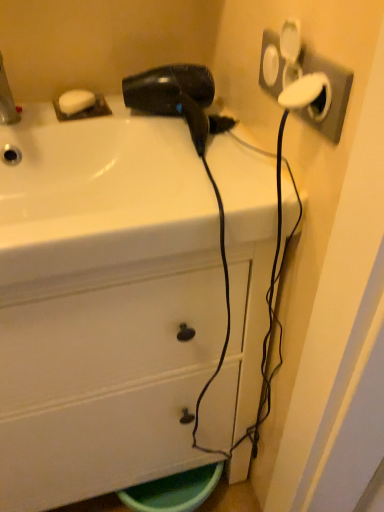
Describe the element at coordinates (304, 75) in the screenshot. I see `white plastic socket at upper right` at that location.

Image resolution: width=384 pixels, height=512 pixels. In order to click on black matte hair dryer at upper center in this screenshot , I will do `click(178, 98)`.

The width and height of the screenshot is (384, 512). Find the location of `brushed metal faucet at upper left`. brushed metal faucet at upper left is located at coordinates (7, 100).

This screenshot has height=512, width=384. What do you see at coordinates (102, 304) in the screenshot?
I see `white glossy cabinet at center` at bounding box center [102, 304].

In order to click on white glossy sink at upper center in this screenshot , I will do `click(99, 193)`.

This screenshot has height=512, width=384. In order to click on white plastic socket at upper right in this screenshot , I will do `click(304, 75)`.

Which is in front, white matte soap at upper left or white glossy sink at upper center?

white glossy sink at upper center is more forward.

In the image, there is a white matte soap at upper left. Find the location of `sink below it (from a real-world perspective)`. sink below it (from a real-world perspective) is located at coordinates (99, 193).

Does white matte soap at upper left contain white glossy sink at upper center?

No.

Is white matte soap at upper left further to camera compared to white glossy cabinet at center?

That is True.

Is white matte soap at upper left oriented towards white glossy cabinet at center?

No, white matte soap at upper left is not turned towards white glossy cabinet at center.

Considering the positions of points (78, 89) and (44, 323), is point (78, 89) closer to camera compared to point (44, 323)?

No, (78, 89) is further to viewer.

Between white glossy sink at upper center and black matte hair dryer at upper center, which one has smaller width?

black matte hair dryer at upper center is thinner.

Is white glossy sink at upper center bigger than black matte hair dryer at upper center?

Indeed, white glossy sink at upper center has a larger size compared to black matte hair dryer at upper center.

From the image's perspective, which one is positioned higher, white glossy sink at upper center or black matte hair dryer at upper center?

From the image's view, black matte hair dryer at upper center is above.

Does white glossy cabinet at center have a lesser height compared to white plastic socket at upper right?

No.

Is white glossy cabinet at center behind white plastic socket at upper right?

Yes, the depth of white glossy cabinet at center is greater than that of white plastic socket at upper right.

From a real-world perspective, is white glossy cabinet at center physically below white plastic socket at upper right?

Correct, in the physical world, white glossy cabinet at center is lower than white plastic socket at upper right.

From the image's perspective, is white glossy cabinet at center located beneath white plastic socket at upper right?

Yes.

In the scene shown: Which of these two, black matte hair dryer at upper center or white plastic socket at upper right, stands taller?

white plastic socket at upper right.

From a real-world perspective, is black matte hair dryer at upper center on top of white plastic socket at upper right?

No.

Visually, is black matte hair dryer at upper center positioned to the left or to the right of white plastic socket at upper right?

black matte hair dryer at upper center is to the left of white plastic socket at upper right.

Is white glossy cabinet at center wider than black matte hair dryer at upper center?

Indeed, white glossy cabinet at center has a greater width compared to black matte hair dryer at upper center.

Are white glossy cabinet at center and black matte hair dryer at upper center far apart?

white glossy cabinet at center is actually quite close to black matte hair dryer at upper center.

Can you confirm if white glossy cabinet at center is smaller than black matte hair dryer at upper center?

Incorrect, white glossy cabinet at center is not smaller in size than black matte hair dryer at upper center.

Between point (188, 450) and point (194, 76), which one is positioned in front?

The point (194, 76) is closer to the camera.

Which point is more distant from viewer, (311, 55) or (115, 414)?

Point (115, 414)

Is white plastic socket at upper right positioned in front of white glossy cabinet at center?

Yes, white plastic socket at upper right is closer to the viewer.

Is white plastic socket at upper right beside white glossy cabinet at center?

No.

From a real-world perspective, which is physically below, white plastic socket at upper right or white glossy cabinet at center?

white glossy cabinet at center.

Find the location of a particular element. This screenshot has height=512, width=384. sink on the right of white matte soap at upper left is located at coordinates (99, 193).

Where is `bathroom cabinet located below the white matte soap at upper left (from the image's perspective)`? bathroom cabinet located below the white matte soap at upper left (from the image's perspective) is located at coordinates (102, 304).

Looking at the image, which one is located closer to white glossy sink at upper center, white matte soap at upper left or white plastic socket at upper right?

white matte soap at upper left lies closer to white glossy sink at upper center than the other object.

Looking at the image, which one is located further to brushed metal faucet at upper left, white glossy cabinet at center or white glossy sink at upper center?

Among the two, white glossy cabinet at center is located further to brushed metal faucet at upper left.

Based on the photo, estimate the real-world distances between objects in this image. Which object is closer to white glossy cabinet at center, brushed metal faucet at upper left or black matte hair dryer at upper center?

black matte hair dryer at upper center lies closer to white glossy cabinet at center than the other object.

Which object lies further to the anchor point white matte soap at upper left, white glossy sink at upper center or white plastic socket at upper right?

white plastic socket at upper right is positioned further to the anchor white matte soap at upper left.

Based on their spatial positions, is brushed metal faucet at upper left or white matte soap at upper left closer to black matte hair dryer at upper center?

white matte soap at upper left.

When comparing their distances from white matte soap at upper left, does white glossy sink at upper center or black matte hair dryer at upper center seem closer?

black matte hair dryer at upper center.

Estimate the real-world distances between objects in this image. Which object is further from black matte hair dryer at upper center, brushed metal faucet at upper left or white plastic socket at upper right?

Based on the image, brushed metal faucet at upper left appears to be further to black matte hair dryer at upper center.

In the scene shown: Looking at the image, which one is located closer to white glossy sink at upper center, black matte hair dryer at upper center or white plastic socket at upper right?

black matte hair dryer at upper center is closer to white glossy sink at upper center.

Find the location of `faucet between white glossy sink at upper center and white matte soap at upper left from front to back`. faucet between white glossy sink at upper center and white matte soap at upper left from front to back is located at coordinates (7, 100).

Locate an element on the screen. The width and height of the screenshot is (384, 512). hair drier positioned between white plastic socket at upper right and white matte soap at upper left from near to far is located at coordinates (178, 98).

Image resolution: width=384 pixels, height=512 pixels. What are the coordinates of `sink between white plastic socket at upper right and white glossy cabinet at center from top to bottom` in the screenshot? It's located at click(99, 193).

The width and height of the screenshot is (384, 512). In order to click on faucet between white matte soap at upper left and white glossy cabinet at center vertically in this screenshot , I will do `click(7, 100)`.